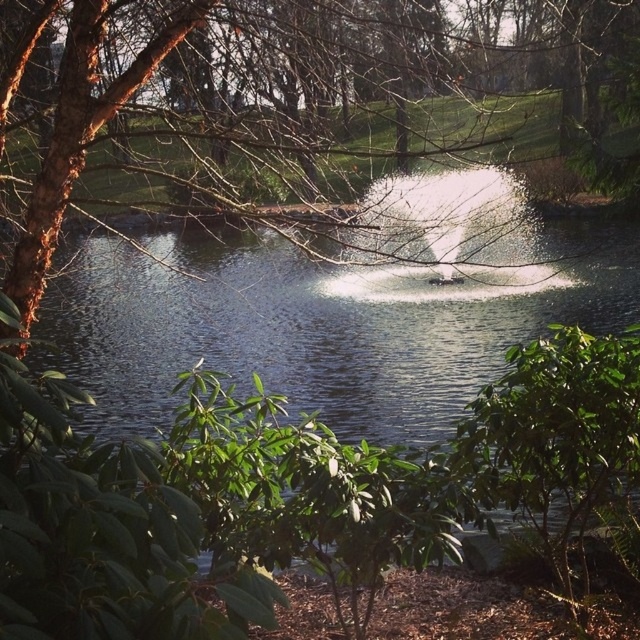
Is brown rough bark tree at upper left thinner than clear water at center?

Correct, brown rough bark tree at upper left's width is less than clear water at center's.

Which is more to the left, brown rough bark tree at upper left or clear water at center?

Positioned to the left is clear water at center.

Between point (216, 122) and point (502, 310), which one is positioned in front?

Point (216, 122)

What are the coordinates of `brown rough bark tree at upper left` in the screenshot? It's located at (268, 128).